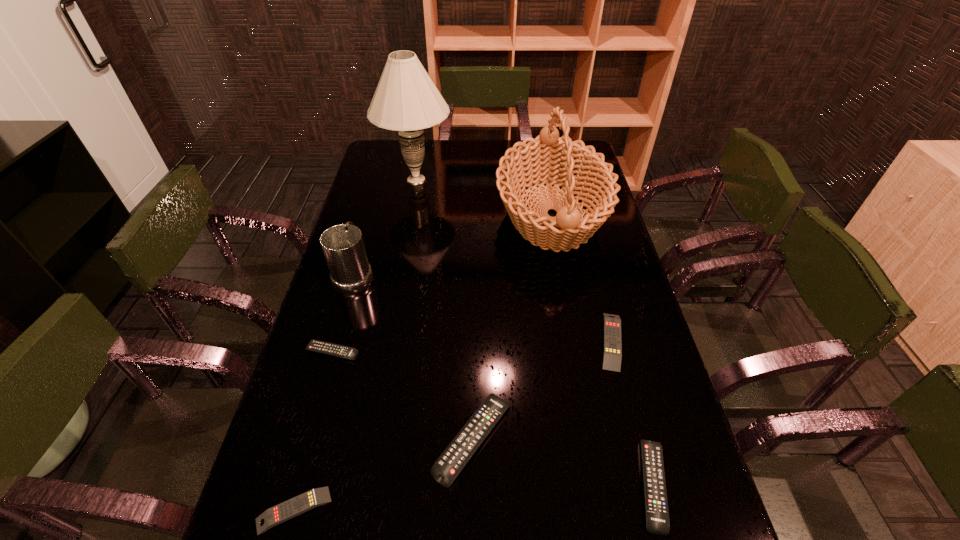
Find the location of `vacant area at the far edge`. vacant area at the far edge is located at coordinates (490, 163).

In the image, there is a desktop. Find the location of `vacant space at the left edge`. vacant space at the left edge is located at coordinates (383, 239).

Where is `free region at the right edge of the desktop`? The height and width of the screenshot is (540, 960). free region at the right edge of the desktop is located at coordinates (625, 379).

Image resolution: width=960 pixels, height=540 pixels. What are the coordinates of `empty space between the smaller yellow remote control and the bigger yellow remote control` in the screenshot? It's located at (452, 426).

Locate an element on the screen. vacant point located between the tallest object and the third remote control from right to left is located at coordinates (444, 309).

This screenshot has height=540, width=960. I want to click on empty space that is in between the rightmost black remote control and the seventh shortest object, so click(x=602, y=350).

Find the location of `free space that is in between the bigger yellow remote control and the beige lampshade`. free space that is in between the bigger yellow remote control and the beige lampshade is located at coordinates (514, 260).

Identify the location of vacant space in between the third tallest object and the biggest black remote control. (414, 356).

In order to click on empty space that is in between the second tallest object and the lampshade in this screenshot , I will do `click(484, 198)`.

This screenshot has height=540, width=960. I want to click on vacant area that lies between the sixth shortest object and the third remote control from left to right, so click(414, 356).